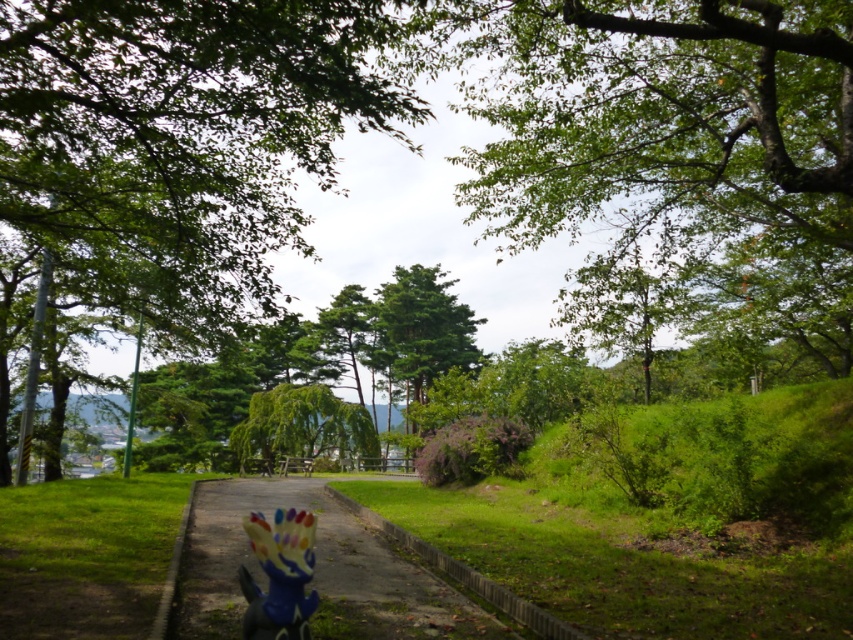
Question: Which of the following is the farthest from the observer?

Choices:
 (A) (312, 580)
 (B) (288, 612)
 (C) (379, 332)
 (D) (537, 172)

Answer: (C)

Question: Which point appears closest to the camera in this image?

Choices:
 (A) (1, 113)
 (B) (387, 365)
 (C) (305, 593)
 (D) (788, 10)

Answer: (C)

Question: Can you confirm if green leafy tree at center is smaller than dull concrete path at center?

Choices:
 (A) no
 (B) yes

Answer: (A)

Question: Among these points, which one is nearest to the camera?

Choices:
 (A) (270, 618)
 (B) (405, 316)
 (C) (228, 584)
 (D) (206, 301)

Answer: (A)

Question: Does green leafy tree at center come in front of green leafy tree at upper center?

Choices:
 (A) no
 (B) yes

Answer: (B)

Question: Can you confirm if green leafy tree at upper center is positioned to the left of plastic rainbow easter bunny at center?

Choices:
 (A) yes
 (B) no

Answer: (B)